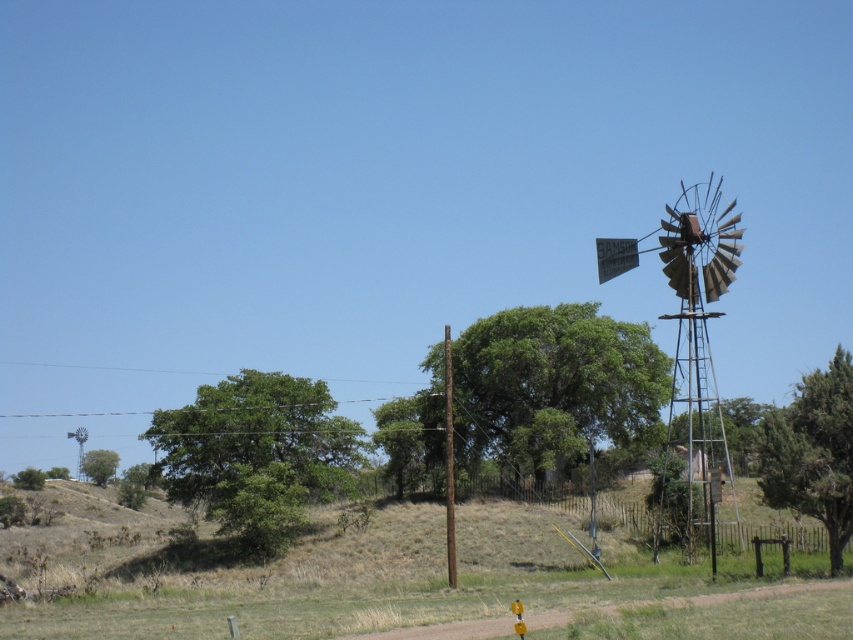
Question: Which object appears farthest from the camera in this image?

Choices:
 (A) brown wooden pole at center
 (B) rusty metal windmill at upper left

Answer: (B)

Question: Is brown wooden pole at center behind rusty metal windmill at upper left?

Choices:
 (A) no
 (B) yes

Answer: (A)

Question: Can you confirm if rusty metal windmill at right is wider than brown wooden pole at center?

Choices:
 (A) no
 (B) yes

Answer: (B)

Question: Which is farther from the rusty metal windmill at right?

Choices:
 (A) brown wooden pole at center
 (B) rusty metal windmill at upper left

Answer: (B)

Question: Does rusty metal windmill at right appear on the right side of rusty metal windmill at upper left?

Choices:
 (A) no
 (B) yes

Answer: (B)

Question: Among these objects, which one is farthest from the camera?

Choices:
 (A) rusty metal windmill at upper left
 (B) brown wooden pole at center
 (C) rusty metal windmill at right

Answer: (A)